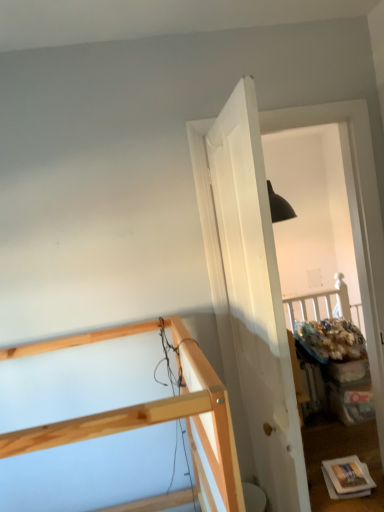
Question: From the image's perspective, would you say natural wood bunk bed at upper left is positioned over white matte door at center?

Choices:
 (A) no
 (B) yes

Answer: (A)

Question: Is natural wood bunk bed at upper left positioned with its back to white matte door at center?

Choices:
 (A) yes
 (B) no

Answer: (B)

Question: Is natural wood bunk bed at upper left not near white matte door at center?

Choices:
 (A) no
 (B) yes

Answer: (A)

Question: From a real-world perspective, does natural wood bunk bed at upper left stand above white matte door at center?

Choices:
 (A) yes
 (B) no

Answer: (B)

Question: Is natural wood bunk bed at upper left directly adjacent to white matte door at center?

Choices:
 (A) yes
 (B) no

Answer: (B)

Question: Is natural wood bunk bed at upper left oriented towards white matte door at center?

Choices:
 (A) no
 (B) yes

Answer: (A)

Question: Does white matte door at center turn towards natural wood bunk bed at upper left?

Choices:
 (A) no
 (B) yes

Answer: (B)

Question: From a real-world perspective, is white matte door at center below natural wood bunk bed at upper left?

Choices:
 (A) yes
 (B) no

Answer: (B)

Question: Can you confirm if white matte door at center is taller than natural wood bunk bed at upper left?

Choices:
 (A) yes
 (B) no

Answer: (A)

Question: Is white matte door at center next to natural wood bunk bed at upper left and touching it?

Choices:
 (A) yes
 (B) no

Answer: (B)

Question: Does white matte door at center have a lesser height compared to natural wood bunk bed at upper left?

Choices:
 (A) yes
 (B) no

Answer: (B)

Question: Can we say white matte door at center lies outside natural wood bunk bed at upper left?

Choices:
 (A) no
 (B) yes

Answer: (B)

Question: Considering the relative positions of white matte door at center and natural wood bunk bed at upper left in the image provided, is white matte door at center to the left or to the right of natural wood bunk bed at upper left?

Choices:
 (A) left
 (B) right

Answer: (B)